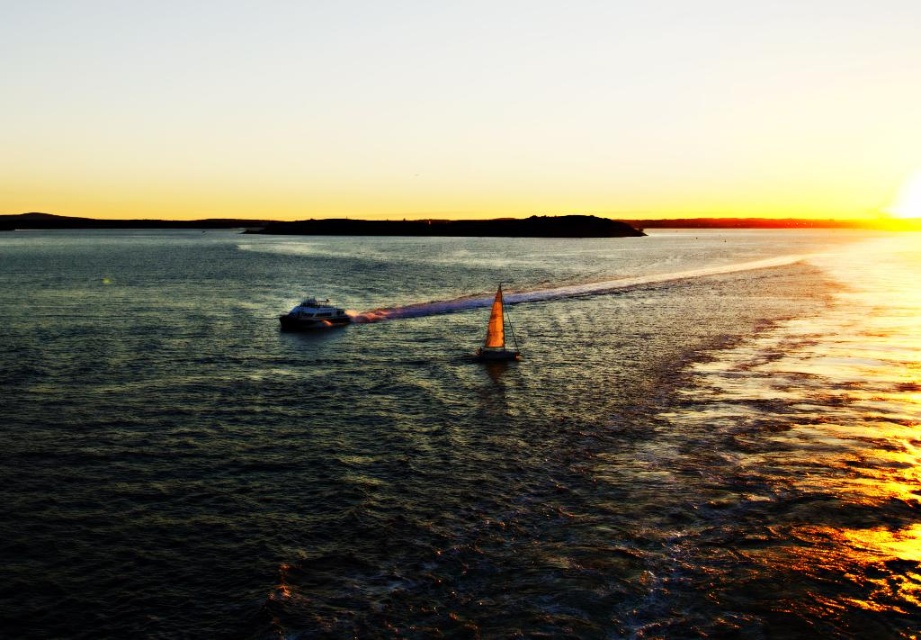
You are a photographer positioned at the center of the scene. You want to capture a photo of the metallic silver boat at left without including the horizon line. Based on its current position, is the boat above or below the horizon line?

The metallic silver boat at left is located at point (312, 316), which places it below the horizon line. Therefore, positioning the camera to exclude the horizon would require framing the shot to focus on the lower portion of the scene where the boat is situated.

Looking at this image, you are a photographer standing at the point marked as point (460, 440). You want to take a photo of the dark blue water at center. Since you are already at the water, where should you point your camera to capture it?

Since you are already at the dark blue water at center located at point (460, 440), you should point your camera downward to capture the water beneath you.